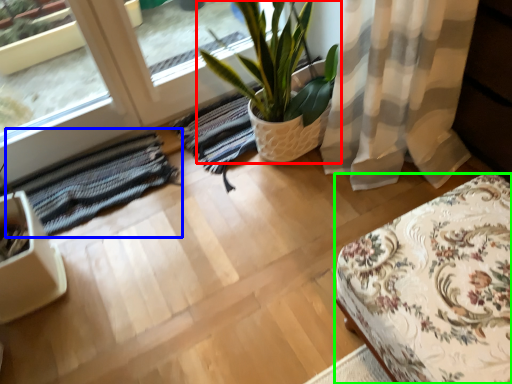
Question: Estimate the real-world distances between objects in this image. Which object is farther from houseplant (highlighted by a red box), mat (highlighted by a blue box) or furniture (highlighted by a green box)?

Choices:
 (A) mat
 (B) furniture

Answer: (B)